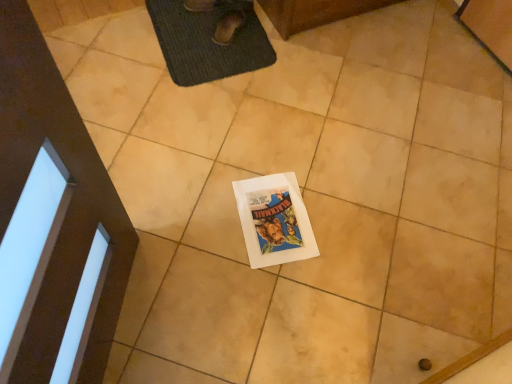
You are a GUI agent. You are given a task and a screenshot of the screen. Output one action in this format:
    pyautogui.click(x=<x>, y=<y>)
    Task: Click on the brown suede shoe at upper center
    This screenshot has width=512, height=384.
    Given the screenshot: What is the action you would take?
    pyautogui.click(x=222, y=16)

This screenshot has width=512, height=384. Describe the element at coordinates (222, 16) in the screenshot. I see `brown suede shoe at upper center` at that location.

In order to face white paper comic book at center, should I rotate leftwards or rightwards?

Rotate your view right by about 2.583°.

Where is `dark gray textured bath mat at upper center`? The height and width of the screenshot is (384, 512). dark gray textured bath mat at upper center is located at coordinates (209, 39).

Considering the relative sizes of brown suede shoe at upper center and white paper comic book at center in the image provided, is brown suede shoe at upper center shorter than white paper comic book at center?

In fact, brown suede shoe at upper center may be taller than white paper comic book at center.

Consider the image. Is brown suede shoe at upper center closer to the viewer compared to white paper comic book at center?

No.

What's the angular difference between brown suede shoe at upper center and white paper comic book at center's facing directions?

They differ by 122 degrees in their facing directions.

Could you tell me if brown suede shoe at upper center is facing white paper comic book at center?

No, brown suede shoe at upper center is not facing towards white paper comic book at center.

How distant is brown suede shoe at upper center from dark gray textured bath mat at upper center?

They are 6.87 centimeters apart.

Which object is more forward, brown suede shoe at upper center or dark gray textured bath mat at upper center?

dark gray textured bath mat at upper center is closer to the camera.

Is dark gray textured bath mat at upper center completely or partially inside brown suede shoe at upper center?

No, brown suede shoe at upper center does not contain dark gray textured bath mat at upper center.

This screenshot has height=384, width=512. Find the location of `person lying on the right of dark gray textured bath mat at upper center`. person lying on the right of dark gray textured bath mat at upper center is located at coordinates (222, 16).

Find the location of a particular element. The width and height of the screenshot is (512, 384). bath mat above the white paper comic book at center (from a real-world perspective) is located at coordinates (209, 39).

Which object is closer to the camera taking this photo, dark gray textured bath mat at upper center or white paper comic book at center?

white paper comic book at center is in front.

Can you confirm if dark gray textured bath mat at upper center is positioned to the left of white paper comic book at center?

Yes, dark gray textured bath mat at upper center is to the left of white paper comic book at center.

Based on their sizes in the image, would you say dark gray textured bath mat at upper center is bigger or smaller than white paper comic book at center?

Clearly, dark gray textured bath mat at upper center is larger in size than white paper comic book at center.

Find the location of a particular element. comic book that is on the right side of brown suede shoe at upper center is located at coordinates (274, 220).

Is white paper comic book at center closer to the viewer compared to brown suede shoe at upper center?

Yes, white paper comic book at center is closer to the viewer.

Which point is more forward, (273, 209) or (220, 17)?

Point (273, 209)

From the image's perspective, is white paper comic book at center under brown suede shoe at upper center?

Indeed, from the image's perspective, white paper comic book at center is shown beneath brown suede shoe at upper center.

Considering the positions of objects white paper comic book at center and dark gray textured bath mat at upper center in the image provided, who is behind, white paper comic book at center or dark gray textured bath mat at upper center?

dark gray textured bath mat at upper center is further from the camera.

Is there a large distance between white paper comic book at center and dark gray textured bath mat at upper center?

Actually, white paper comic book at center and dark gray textured bath mat at upper center are a little close together.

Is point (263, 219) positioned after point (223, 10)?

No, (263, 219) is in front of (223, 10).

Between white paper comic book at center and dark gray textured bath mat at upper center, which one appears on the right side from the viewer's perspective?

Positioned to the right is white paper comic book at center.

From a real-world perspective, who is located higher, dark gray textured bath mat at upper center or brown suede shoe at upper center?

brown suede shoe at upper center.

Can you confirm if dark gray textured bath mat at upper center is smaller than brown suede shoe at upper center?

Actually, dark gray textured bath mat at upper center might be larger than brown suede shoe at upper center.

Which is more to the right, dark gray textured bath mat at upper center or brown suede shoe at upper center?

brown suede shoe at upper center is more to the right.

Considering the relative sizes of dark gray textured bath mat at upper center and brown suede shoe at upper center in the image provided, is dark gray textured bath mat at upper center thinner than brown suede shoe at upper center?

No.

The height and width of the screenshot is (384, 512). I want to click on comic book in front of the brown suede shoe at upper center, so click(274, 220).

Locate an element on the screen. The height and width of the screenshot is (384, 512). person behind the dark gray textured bath mat at upper center is located at coordinates (222, 16).

Estimate the real-world distances between objects in this image. Which object is closer to dark gray textured bath mat at upper center, brown suede shoe at upper center or white paper comic book at center?

brown suede shoe at upper center lies closer to dark gray textured bath mat at upper center than the other object.

Based on their spatial positions, is white paper comic book at center or dark gray textured bath mat at upper center further from brown suede shoe at upper center?

white paper comic book at center is further to brown suede shoe at upper center.

Looking at the image, which one is located closer to brown suede shoe at upper center, dark gray textured bath mat at upper center or white paper comic book at center?

dark gray textured bath mat at upper center.

Considering their positions, is dark gray textured bath mat at upper center positioned closer to white paper comic book at center than brown suede shoe at upper center?

The object closer to white paper comic book at center is dark gray textured bath mat at upper center.

When comparing their distances from white paper comic book at center, does brown suede shoe at upper center or dark gray textured bath mat at upper center seem closer?

Based on the image, dark gray textured bath mat at upper center appears to be nearer to white paper comic book at center.

Considering their positions, is white paper comic book at center positioned closer to dark gray textured bath mat at upper center than brown suede shoe at upper center?

brown suede shoe at upper center.

You are a GUI agent. You are given a task and a screenshot of the screen. Output one action in this format:
    pyautogui.click(x=<x>, y=<y>)
    Task: Click on the bath mat between brown suede shoe at upper center and white paper comic book at center vertically
    The image size is (512, 384).
    Given the screenshot: What is the action you would take?
    pyautogui.click(x=209, y=39)